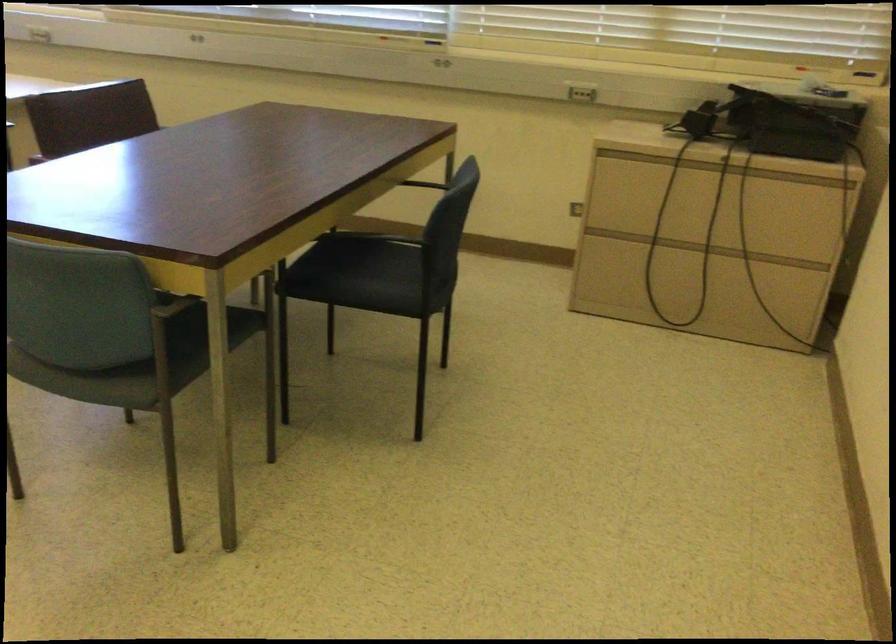
Locate an element on the screen. black chair sitting surface is located at coordinates (348, 261).